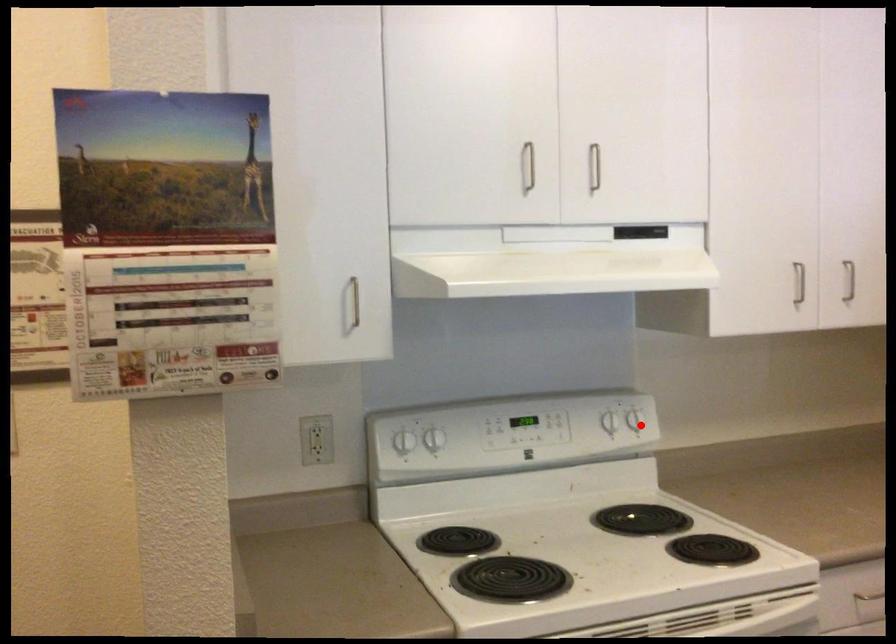
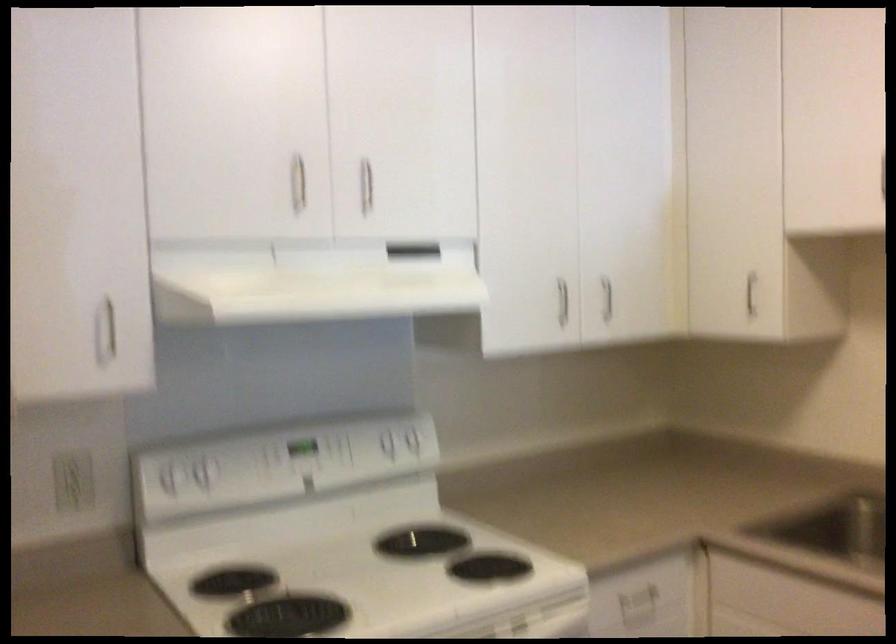
In the second image, find the point that corresponds to the highlighted location in the first image.

(419, 444)